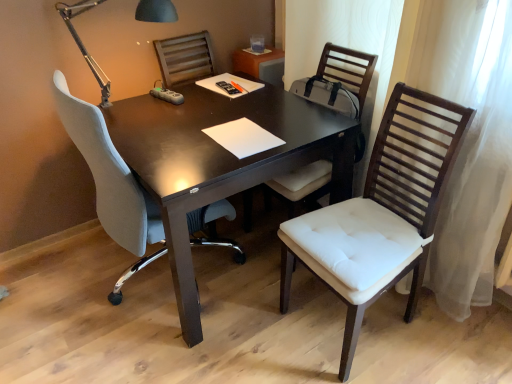
Where is `free space in front of matte black table lamp at upper left`? The height and width of the screenshot is (384, 512). free space in front of matte black table lamp at upper left is located at coordinates (163, 141).